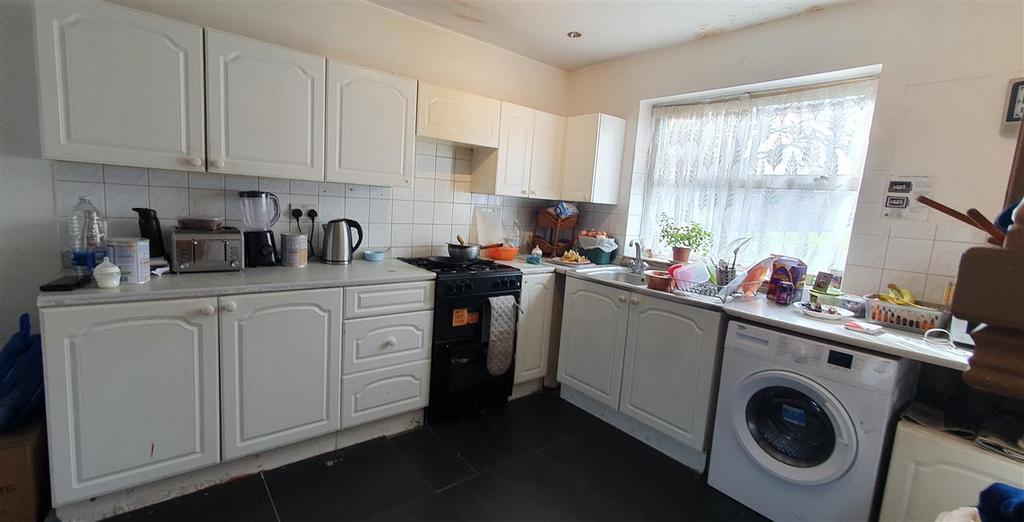
Where is `curtains`? curtains is located at coordinates (719, 114), (802, 137), (801, 201), (701, 207).